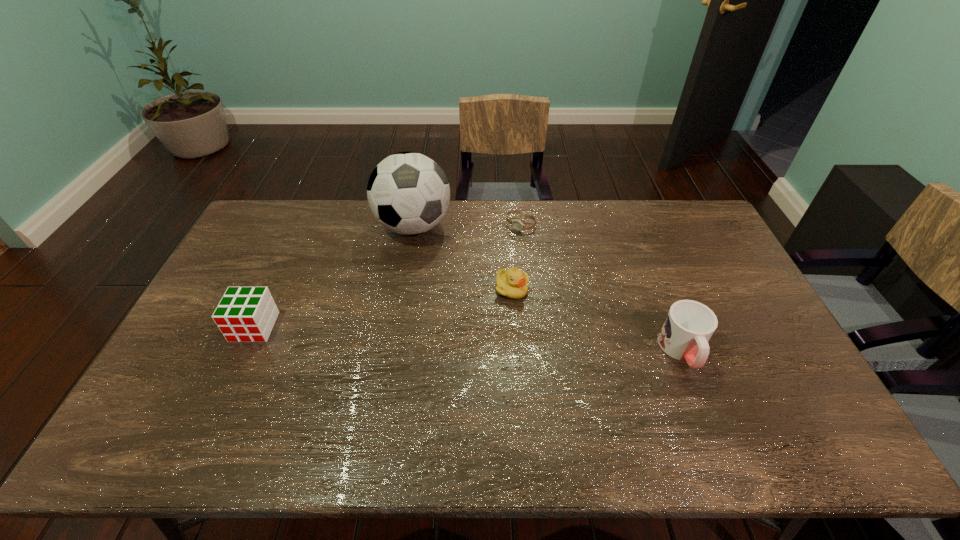
Where is `cube`? The height and width of the screenshot is (540, 960). cube is located at coordinates (247, 314).

Identify the location of the rightmost object. (689, 325).

Image resolution: width=960 pixels, height=540 pixels. What are the coordinates of `watch` in the screenshot? It's located at (517, 224).

At what (x,y) coordinates should I click in order to perform the action: click on the third farthest object. Please return your answer as a coordinate pair (x, y). This screenshot has width=960, height=540. Looking at the image, I should click on (513, 283).

Locate an element on the screen. duckling is located at coordinates (513, 283).

The width and height of the screenshot is (960, 540). I want to click on soccer ball, so click(x=408, y=193).

This screenshot has height=540, width=960. In order to click on the tallest object in this screenshot , I will do `click(408, 193)`.

You are a GUI agent. You are given a task and a screenshot of the screen. Output one action in this format:
    pyautogui.click(x=<x>, y=<y>)
    Task: Click on the free space located on the red face of the leftmost object
    
    Given the screenshot: What is the action you would take?
    pyautogui.click(x=221, y=400)

Identify the location of vacant space located 0.050m on the side of the mug with the handle. The width and height of the screenshot is (960, 540). (700, 394).

You are a GUI agent. You are given a task and a screenshot of the screen. Output one action in this format:
    pyautogui.click(x=<x>, y=<y>)
    Task: Click on the vacant region located 0.090m on the face of the shortest object
    
    Given the screenshot: What is the action you would take?
    pyautogui.click(x=500, y=245)